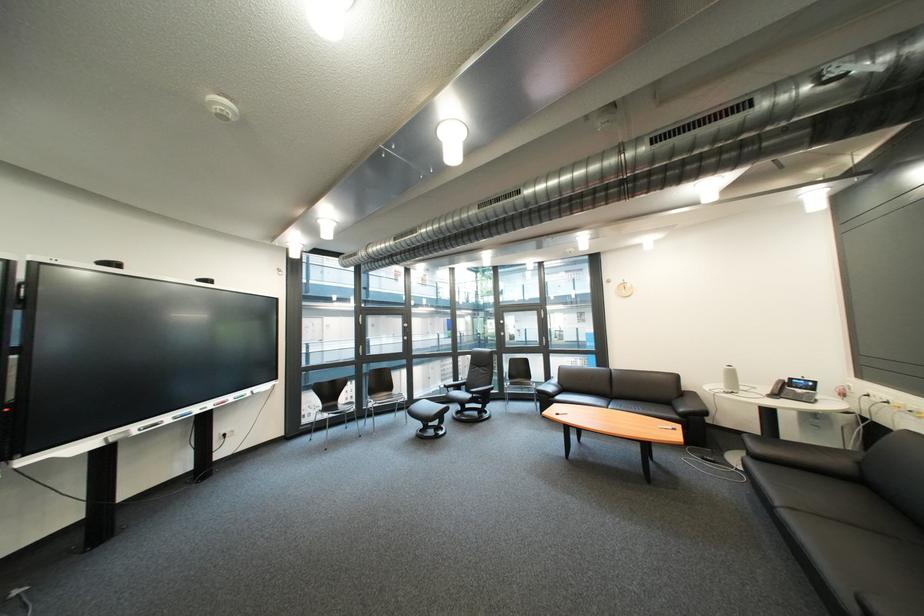
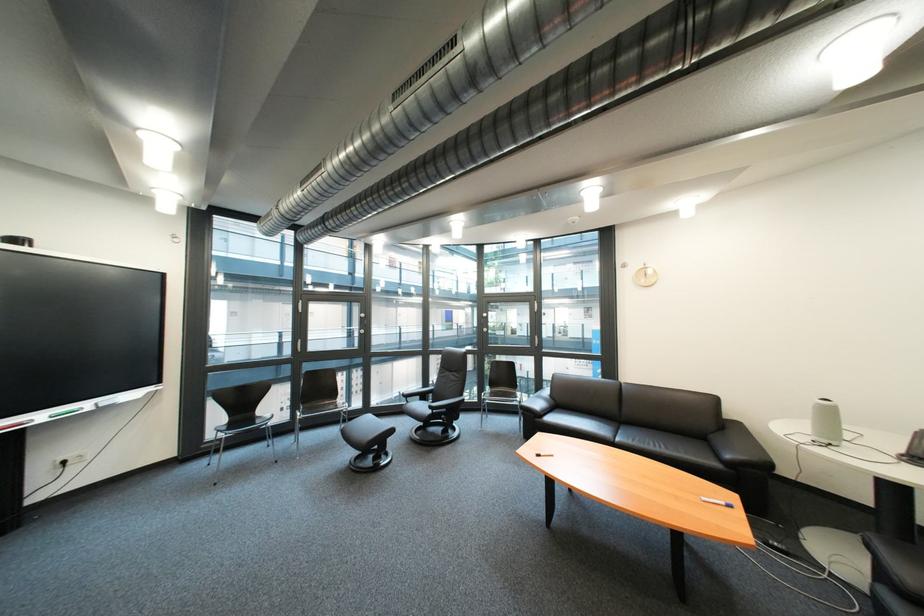
The point at (x=673, y=428) is marked in the first image. Where is the corresponding point in the second image?

(718, 501)